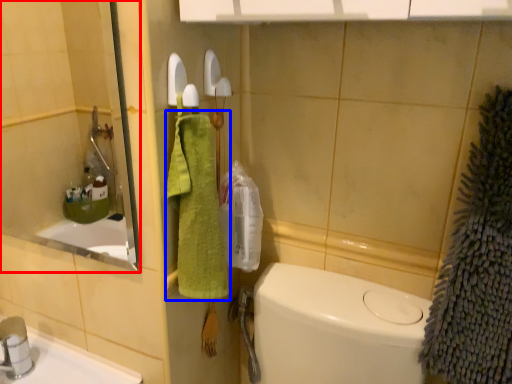
Question: Which object appears farthest to the camera in this image, mirror (highlighted by a red box) or bath towel (highlighted by a blue box)?

Choices:
 (A) mirror
 (B) bath towel

Answer: (B)